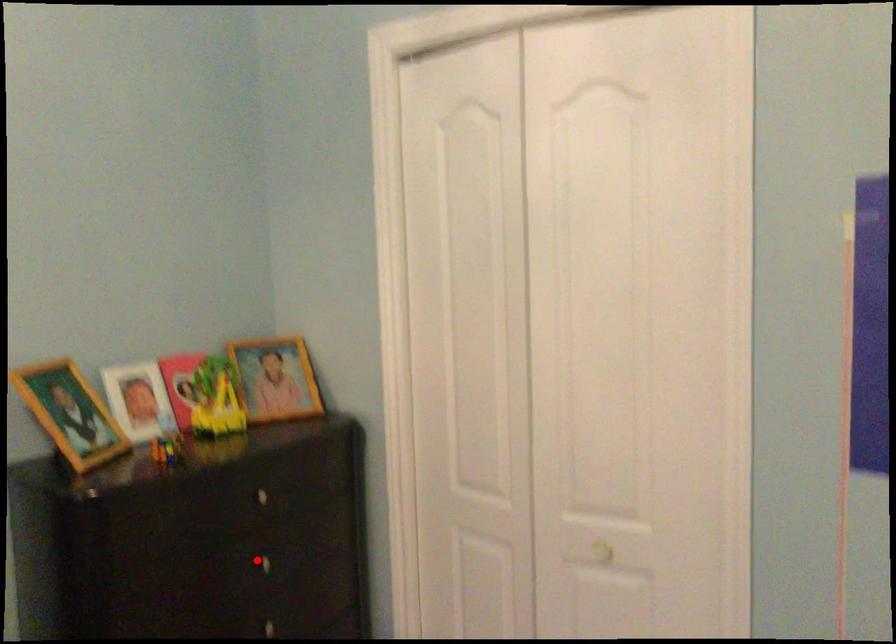
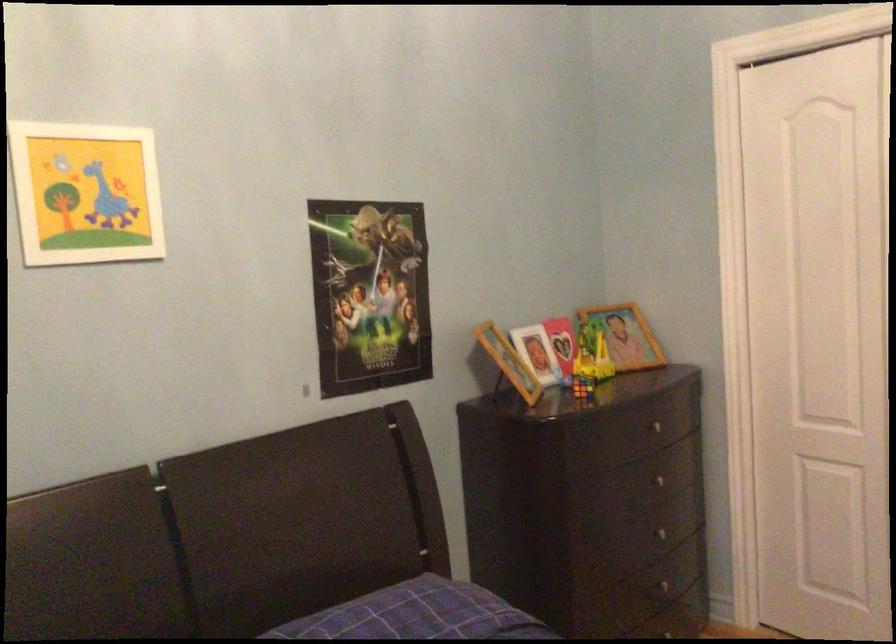
The point at the highlighted location is marked in the first image. Where is the corresponding point in the second image?

(656, 480)